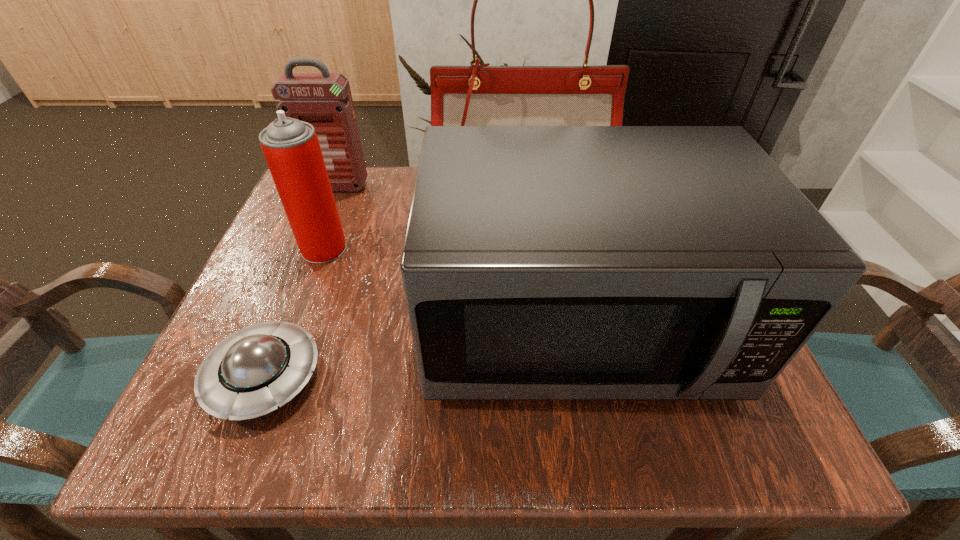
Where is `vacant area that lies between the shortest object and the first-aid kit`? vacant area that lies between the shortest object and the first-aid kit is located at coordinates (300, 282).

The width and height of the screenshot is (960, 540). Find the location of `free space between the saucer and the handbag`. free space between the saucer and the handbag is located at coordinates (393, 281).

Select which object appears as the third closest to the saucer. Please provide its 2D coordinates. Your answer should be formatted as a tuple, i.e. [(x, y)], where the tuple contains the x and y coordinates of a point satisfying the conditions above.

[(478, 95)]

The width and height of the screenshot is (960, 540). In order to click on object that is the second nearest to the first-aid kit in this screenshot , I will do `click(478, 95)`.

This screenshot has height=540, width=960. I want to click on free space that satisfies the following two spatial constraints: 1. on the front-facing side of the aerosol can; 2. on the right side of the first-aid kit, so click(x=312, y=248).

The image size is (960, 540). Identify the location of vacant space that satisfies the following two spatial constraints: 1. on the front-facing side of the saucer; 2. on the right side of the first-aid kit. (259, 377).

Locate an element on the screen. This screenshot has height=540, width=960. free location that satisfies the following two spatial constraints: 1. on the front-facing side of the first-aid kit; 2. on the right side of the aerosol can is located at coordinates (312, 248).

Image resolution: width=960 pixels, height=540 pixels. I want to click on vacant space that satisfies the following two spatial constraints: 1. on the front-facing side of the saucer; 2. on the left side of the first-aid kit, so [259, 377].